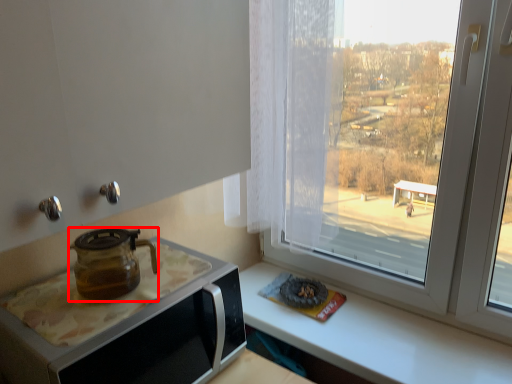
Question: From the image's perspective, what is the correct spatial positioning of kitchen appliance (annotated by the red box) in reference to appliance?

Choices:
 (A) below
 (B) above

Answer: (B)